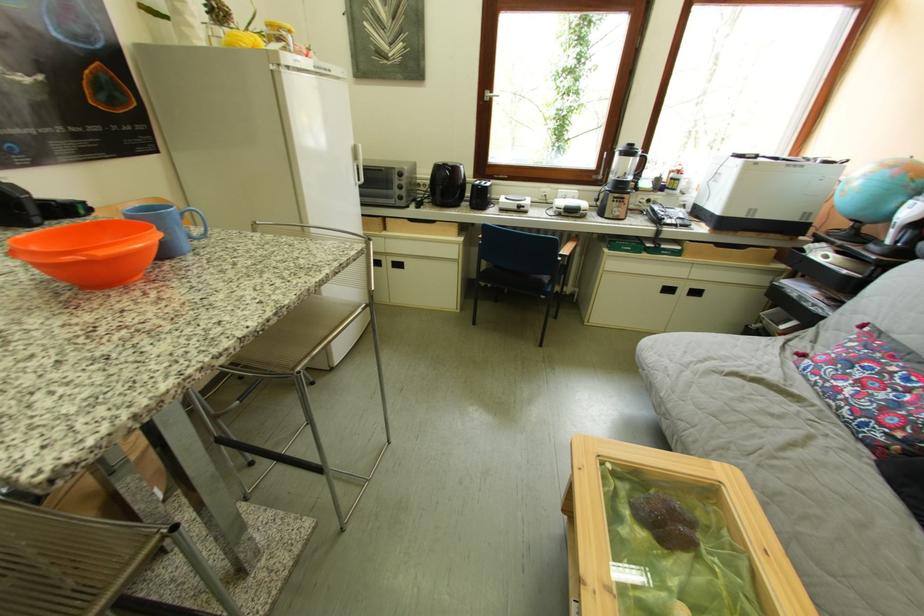
Where is `window handle`? This screenshot has height=616, width=924. window handle is located at coordinates (489, 95).